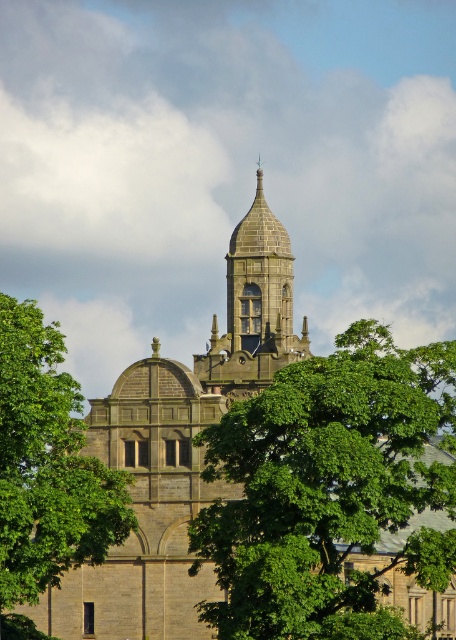
Question: Is green leafy tree at center smaller than stone steeple at center?

Choices:
 (A) yes
 (B) no

Answer: (B)

Question: Based on their relative distances, which object is nearer to the green leafy tree at center?

Choices:
 (A) stone steeple at center
 (B) green leafy tree at left

Answer: (B)

Question: Is green leafy tree at center closer to camera compared to green leafy tree at left?

Choices:
 (A) yes
 (B) no

Answer: (A)

Question: Which point is closer to the camera taking this photo?

Choices:
 (A) (321, 410)
 (B) (253, 362)

Answer: (A)

Question: Can you confirm if green leafy tree at left is positioned above stone steeple at center?

Choices:
 (A) yes
 (B) no

Answer: (B)

Question: Which object is the closest to the green leafy tree at center?

Choices:
 (A) stone steeple at center
 (B) green leafy tree at left

Answer: (B)